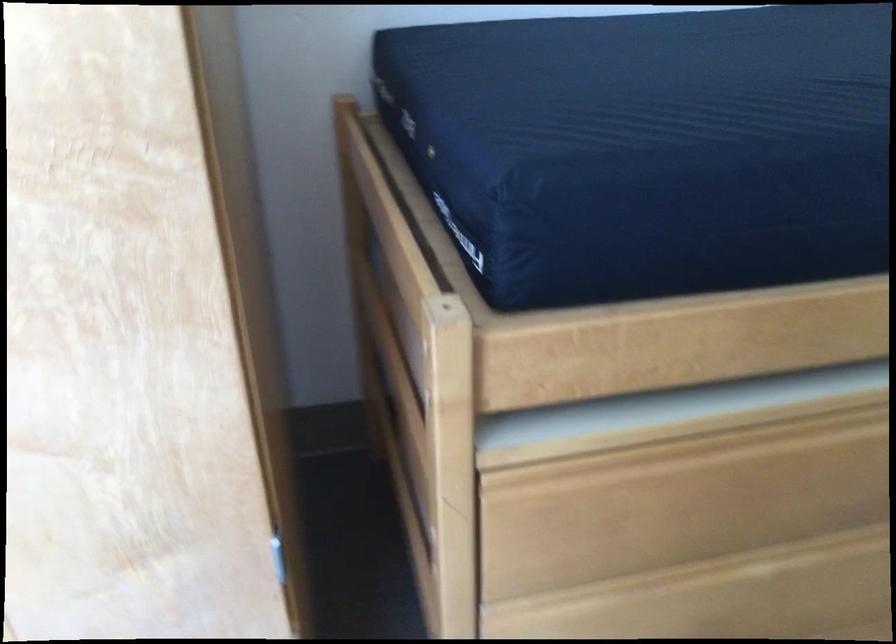
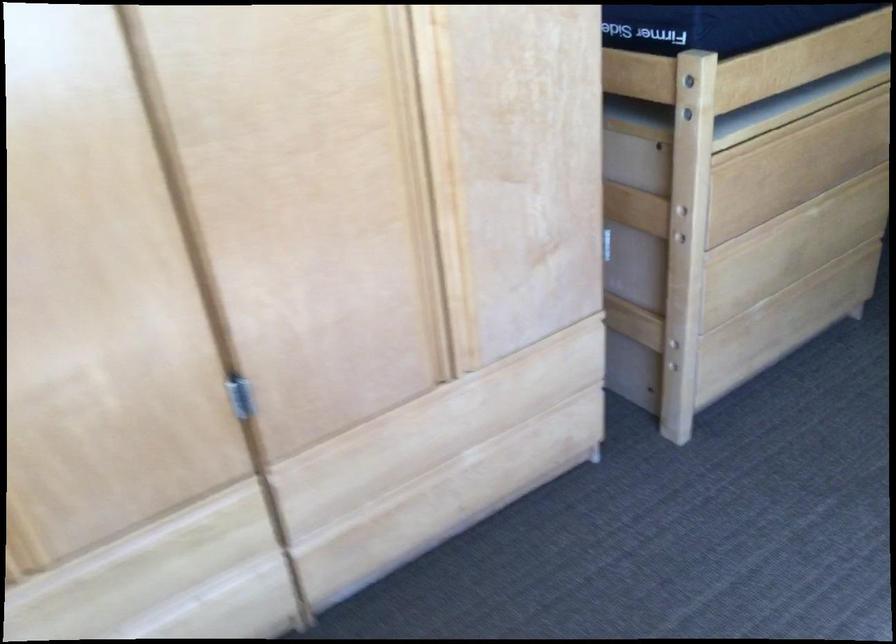
Where in the second image is the point corresponding to pixel 434 410 from the first image?

(688, 116)